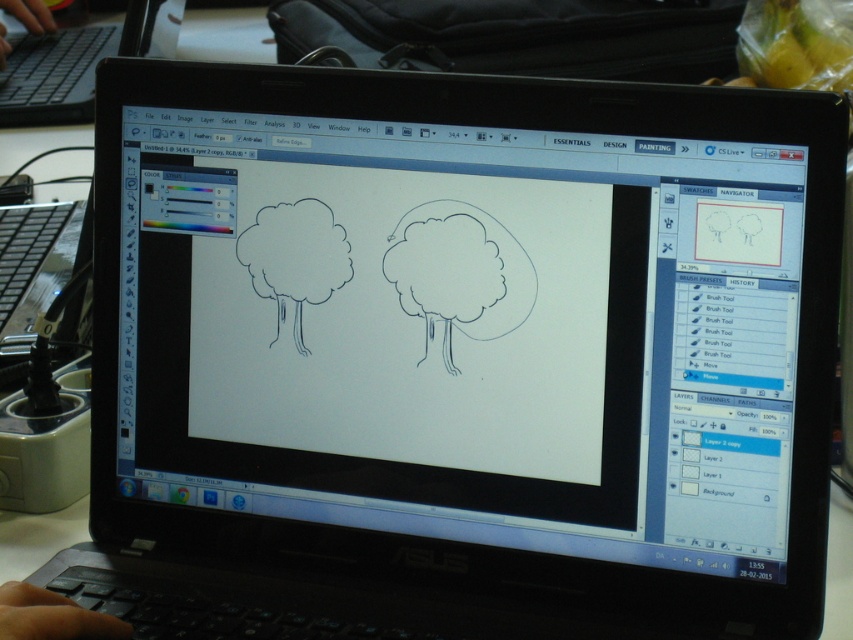
Who is taller, black plastic laptop at upper left or skinny finger at lower left?

Standing taller between the two is black plastic laptop at upper left.

Which is more to the left, black plastic laptop at upper left or skinny finger at lower left?

black plastic laptop at upper left

Describe the element at coordinates (79, 61) in the screenshot. I see `black plastic laptop at upper left` at that location.

The height and width of the screenshot is (640, 853). Find the location of `black plastic laptop at upper left`. black plastic laptop at upper left is located at coordinates (79, 61).

Does skinny finger at lower left appear on the left side of black plastic keyboard at upper left?

No, skinny finger at lower left is not to the left of black plastic keyboard at upper left.

Is point (97, 634) in front of point (4, 0)?

Yes, it is.

Image resolution: width=853 pixels, height=640 pixels. What do you see at coordinates (51, 616) in the screenshot? I see `skinny finger at lower left` at bounding box center [51, 616].

Locate an element on the screen. skinny finger at lower left is located at coordinates (51, 616).

Can you confirm if black plastic laptop at upper left is shorter than black plastic keyboard at upper left?

In fact, black plastic laptop at upper left may be taller than black plastic keyboard at upper left.

Does black plastic laptop at upper left have a greater height compared to black plastic keyboard at upper left?

Yes.

Is point (80, 61) farther from camera compared to point (38, 28)?

That is False.

Identify the location of black plastic laptop at upper left. (79, 61).